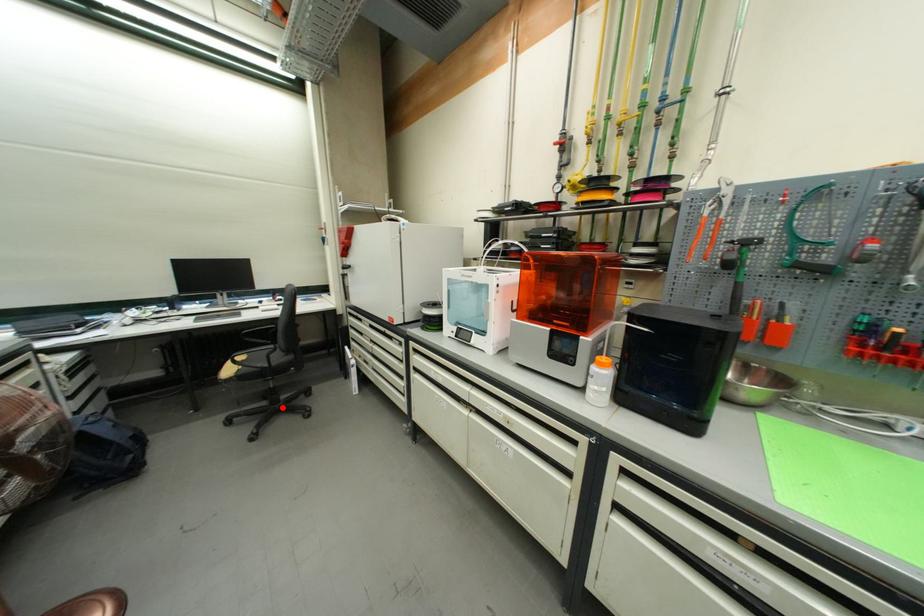
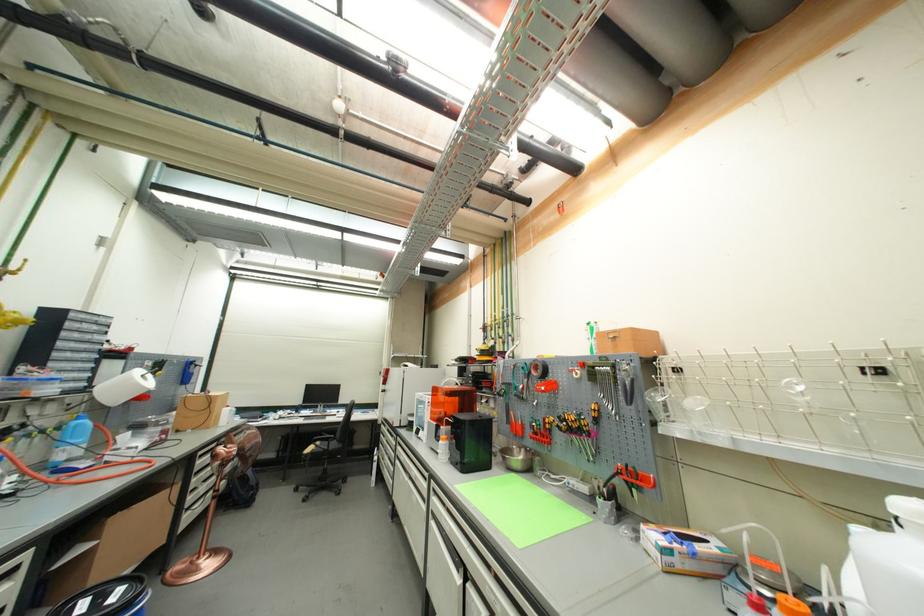
Locate, in the second image, the point that corresponds to the highlighted location in the first image.

(330, 485)